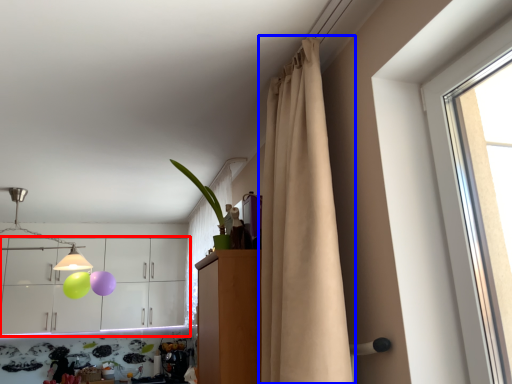
Question: Which object appears closest to the camera in this image, cabinetry (highlighted by a red box) or curtain (highlighted by a blue box)?

Choices:
 (A) cabinetry
 (B) curtain

Answer: (B)